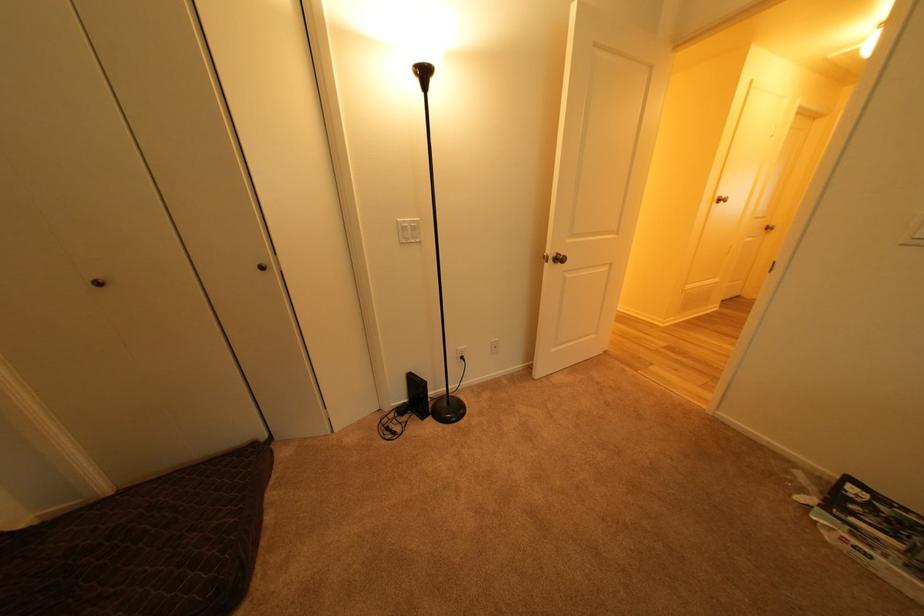
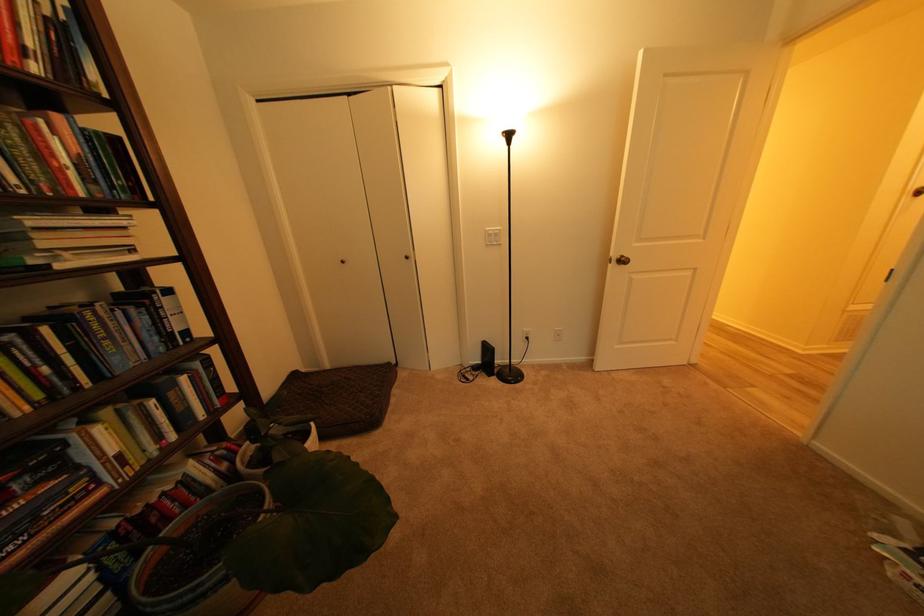
In a continuous first-person perspective shot, in which direction is the camera moving?

The cameraman walked toward right, backward.